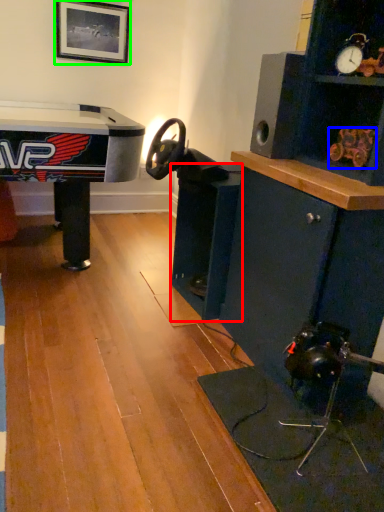
Question: Based on their relative distances, which object is farther from shelf (highlighted by a red box)? Choose from toy (highlighted by a blue box) and picture frame (highlighted by a green box).

Choices:
 (A) toy
 (B) picture frame

Answer: (B)